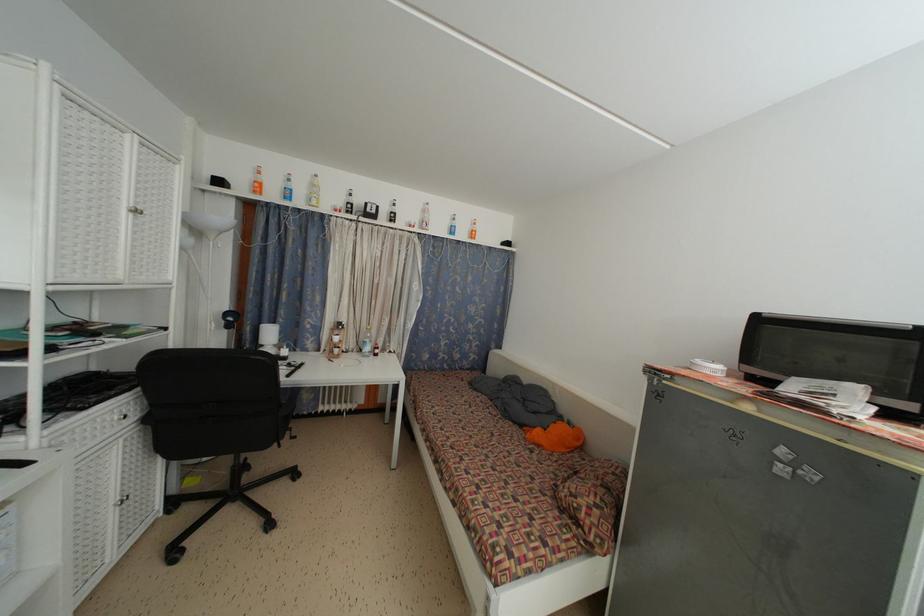
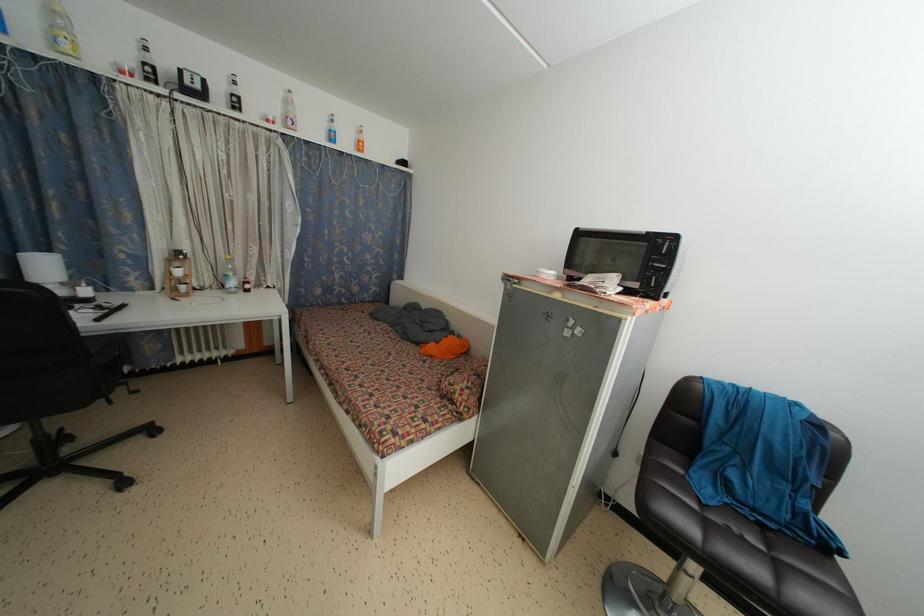
Where in the second image is the point corresponding to (x=477, y=237) from the first image?

(362, 147)